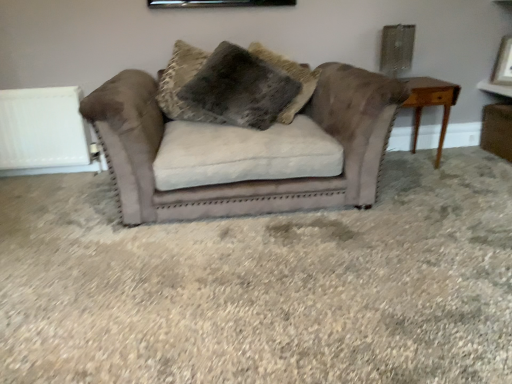
The image size is (512, 384). What are the coordinates of `free point to the right of light brown wooden table at right` in the screenshot? It's located at (464, 168).